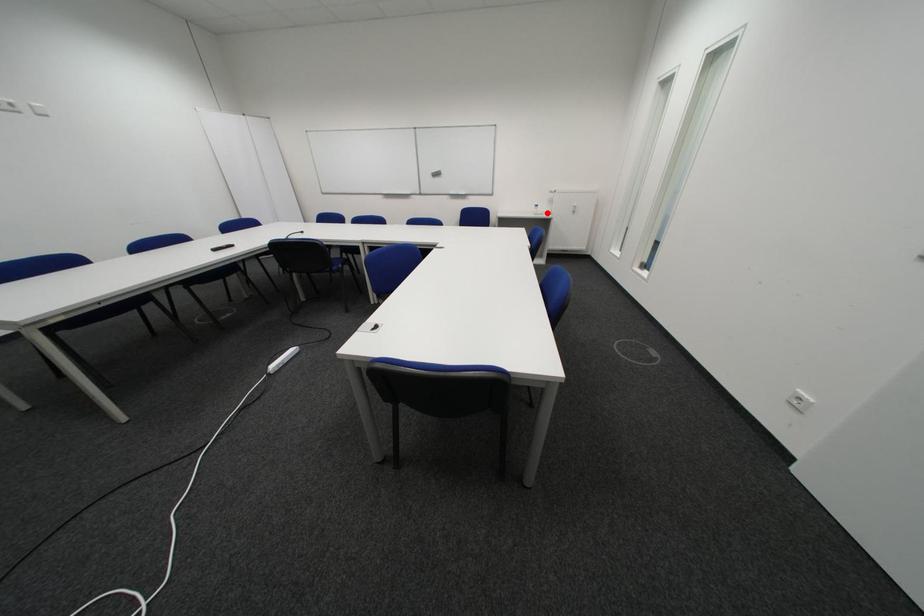
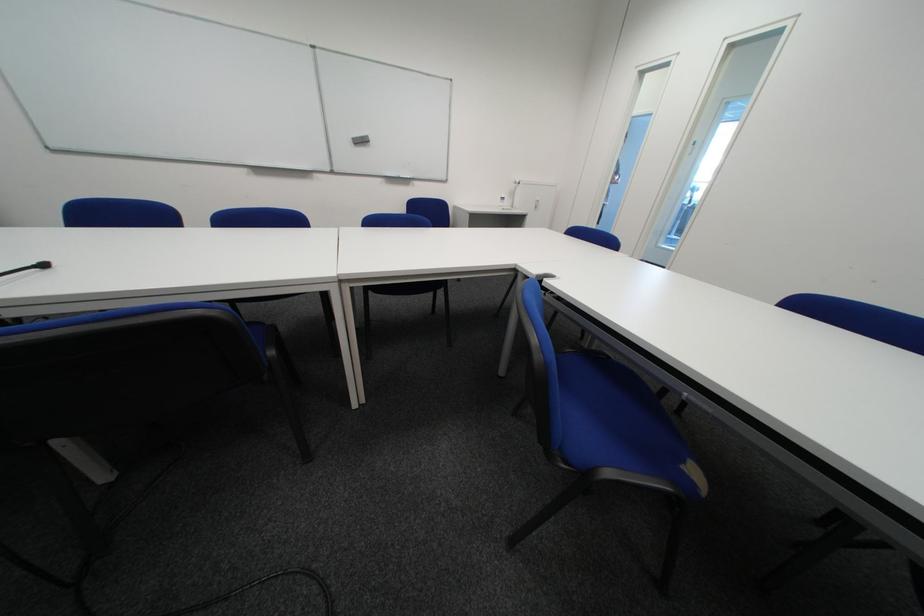
The point at the highlighted location is marked in the first image. Where is the corresponding point in the second image?

(513, 207)